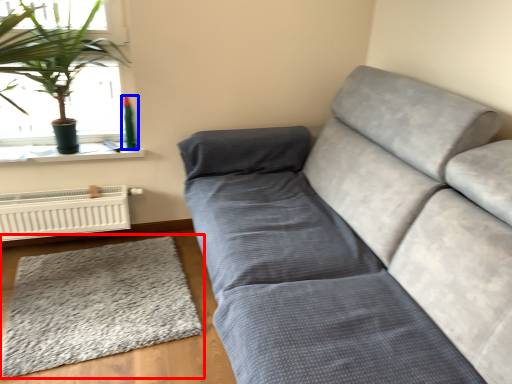
Question: Which point is further to the camera, mat (highlighted by a red box) or teal (highlighted by a blue box)?

Choices:
 (A) mat
 (B) teal

Answer: (B)